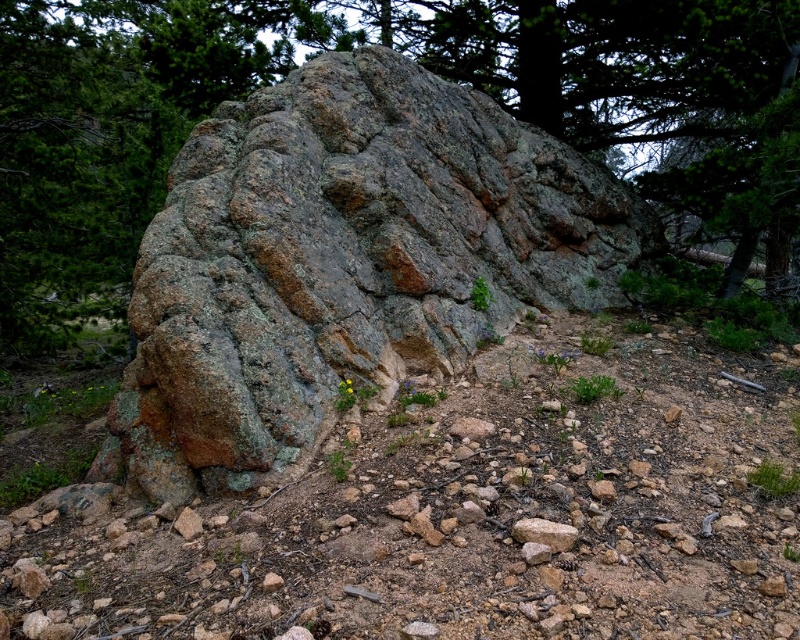
Is rusty granite boulder at center taller than gray rough stone at center?

Indeed, rusty granite boulder at center has a greater height compared to gray rough stone at center.

At what (x,y) coordinates should I click in order to perform the action: click on rusty granite boulder at center. Please return your answer as a coordinate pair (x, y). This screenshot has width=800, height=640. Looking at the image, I should click on (344, 262).

Find the location of a particular element. Image resolution: width=800 pixels, height=640 pixels. rusty granite boulder at center is located at coordinates (344, 262).

Locate an element on the screen. rusty granite boulder at center is located at coordinates (344, 262).